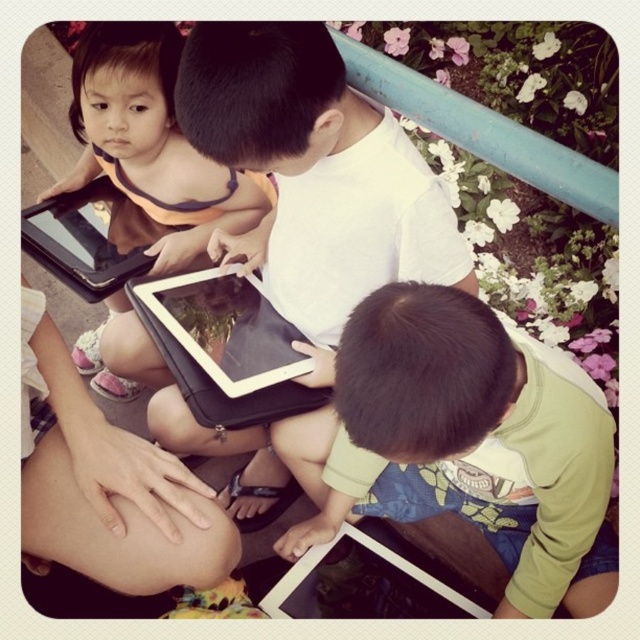
Question: In this image, where is matte black tablet at upper left located relative to black matte tablet at center?

Choices:
 (A) right
 (B) left

Answer: (B)

Question: Can you confirm if matte black tablet at upper left is positioned to the left of matte black tablet at lower center?

Choices:
 (A) yes
 (B) no

Answer: (A)

Question: Which point is farther to the camera?

Choices:
 (A) (529, 534)
 (B) (276, 284)

Answer: (B)

Question: Among these points, which one is farthest from the camera?

Choices:
 (A) (157, 305)
 (B) (484, 593)
 (C) (182, 232)

Answer: (B)

Question: Based on their relative distances, which object is nearer to the white matte tablet at center?

Choices:
 (A) matte black tablet at upper left
 (B) green matte shirt at lower right
 (C) matte black tablet at lower center

Answer: (B)

Question: Can you confirm if matte black tablet at upper left is wider than matte black tablet at lower center?

Choices:
 (A) no
 (B) yes

Answer: (B)